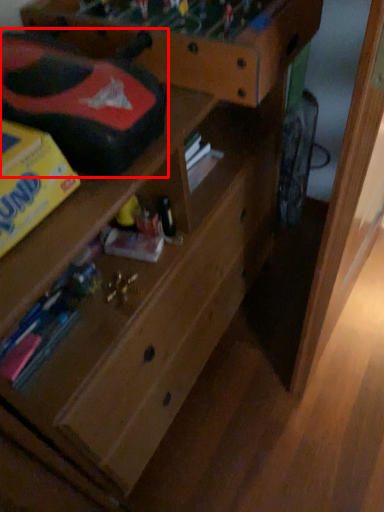
Question: From the image's perspective, considering the relative positions of toy car (annotated by the red box) and shelf in the image provided, where is toy car (annotated by the red box) located with respect to the staircase?

Choices:
 (A) above
 (B) below

Answer: (B)